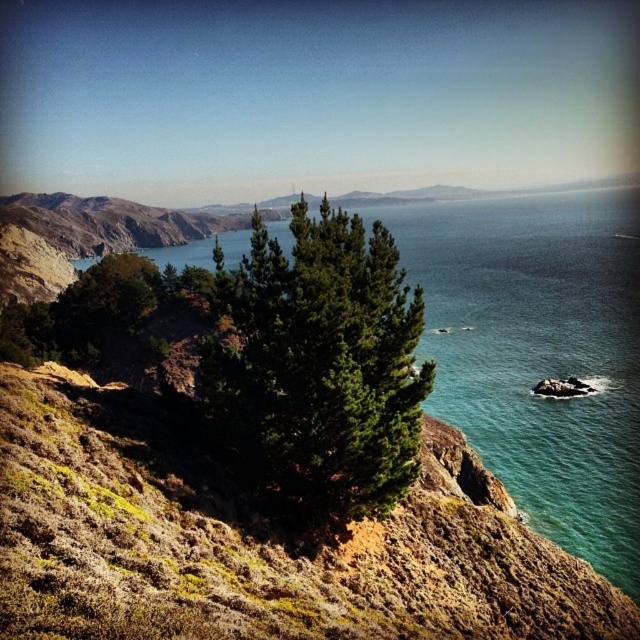
You are standing on the rugged, rocky hillside in the scene and want to reach the greenish blue water at center. According to the coordinates provided, what direction should you head to from your current position at point (540, 353)?

The point (540, 353) is already at the greenish blue water at center, so you are already there.